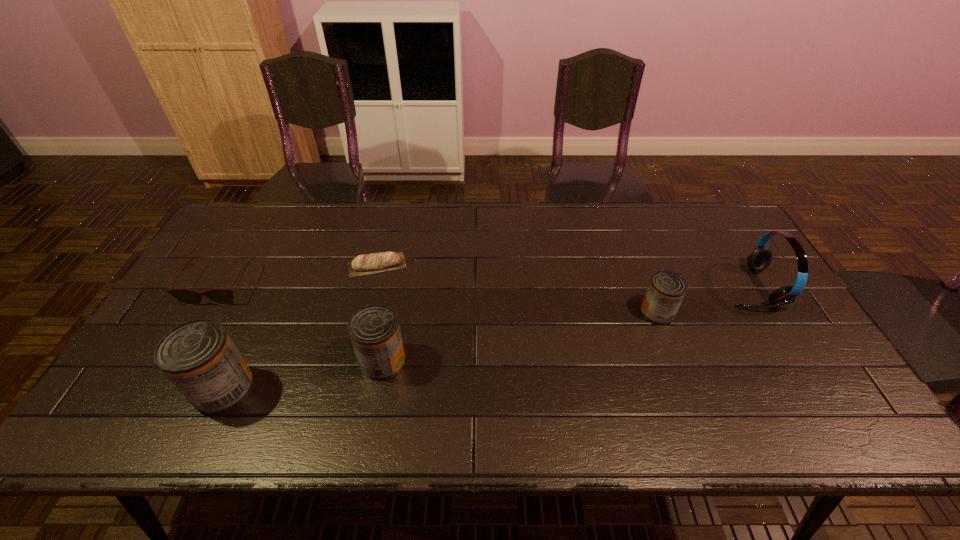
Please mark a free spot for a new can to balance the arrangement. Please provide its 2D coordinates. Your answer should be formatted as a tuple, i.e. [(x, y)], where the tuple contains the x and y coordinates of a point satisfying the conditions above.

[(527, 336)]